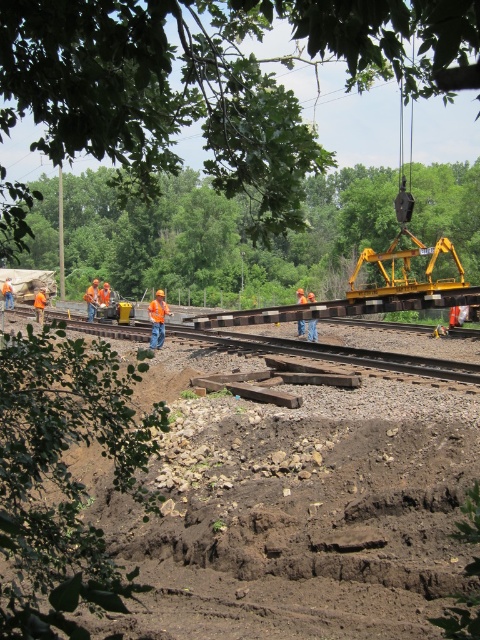
Is yellow metallic crane at right smaller than orange hard hat at left?

Yes.

Is yellow metallic crane at right shorter than orange hard hat at left?

No, yellow metallic crane at right is not shorter than orange hard hat at left.

At what (x,y) coordinates should I click in order to perform the action: click on yellow metallic crane at right. Please return your answer as a coordinate pair (x, y). Image resolution: width=480 pixels, height=640 pixels. Looking at the image, I should click on (406, 269).

Which is below, brown wooden track at center or yellow metallic crane at right?

brown wooden track at center is below.

This screenshot has height=640, width=480. Describe the element at coordinates (336, 353) in the screenshot. I see `brown wooden track at center` at that location.

This screenshot has width=480, height=640. Identify the location of brown wooden track at center. (336, 353).

Is point (420, 417) farther from camera compared to point (93, 308)?

No, (420, 417) is in front of (93, 308).

Identify the location of brown dirt at center. (238, 486).